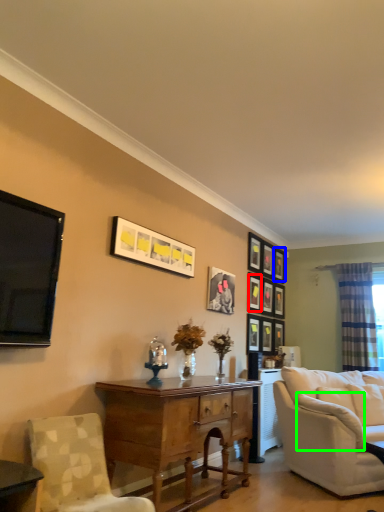
Question: Which is nearer to the picture frame (highlighted by a red box)? picture frame (highlighted by a blue box) or pillow (highlighted by a green box).

Choices:
 (A) picture frame
 (B) pillow

Answer: (A)